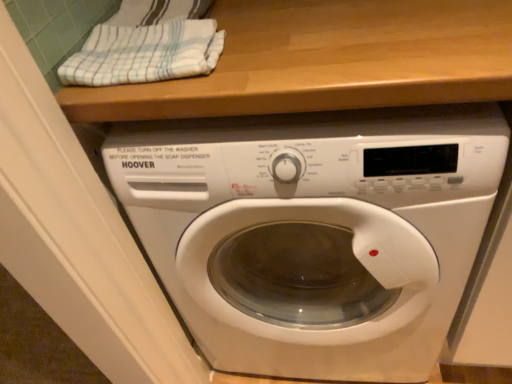
Question: Does white striped towel at upper left have a smaller size compared to white glossy washing machine at center?

Choices:
 (A) yes
 (B) no

Answer: (A)

Question: Is white striped towel at upper left oriented away from white glossy washing machine at center?

Choices:
 (A) yes
 (B) no

Answer: (B)

Question: Is white striped towel at upper left to the left of white glossy washing machine at center from the viewer's perspective?

Choices:
 (A) yes
 (B) no

Answer: (A)

Question: Does white striped towel at upper left appear on the right side of white glossy washing machine at center?

Choices:
 (A) no
 (B) yes

Answer: (A)

Question: Considering the relative sizes of white striped towel at upper left and white glossy washing machine at center in the image provided, is white striped towel at upper left bigger than white glossy washing machine at center?

Choices:
 (A) no
 (B) yes

Answer: (A)

Question: Considering the relative positions of white striped towel at upper left and white glossy washing machine at center in the image provided, is white striped towel at upper left behind white glossy washing machine at center?

Choices:
 (A) no
 (B) yes

Answer: (B)

Question: Is white glossy washing machine at center beside white striped towel at upper left?

Choices:
 (A) yes
 (B) no

Answer: (B)

Question: Does white glossy washing machine at center come behind white striped towel at upper left?

Choices:
 (A) no
 (B) yes

Answer: (A)

Question: Is white glossy washing machine at center to the right of white striped towel at upper left from the viewer's perspective?

Choices:
 (A) no
 (B) yes

Answer: (B)

Question: Can you confirm if white glossy washing machine at center is smaller than white striped towel at upper left?

Choices:
 (A) yes
 (B) no

Answer: (B)

Question: Is white striped towel at upper left at the back of white glossy washing machine at center?

Choices:
 (A) yes
 (B) no

Answer: (B)

Question: Is white glossy washing machine at center bigger than white striped towel at upper left?

Choices:
 (A) yes
 (B) no

Answer: (A)

Question: Looking at their shapes, would you say white striped towel at upper left is wider or thinner than white glossy washing machine at center?

Choices:
 (A) wide
 (B) thin

Answer: (B)